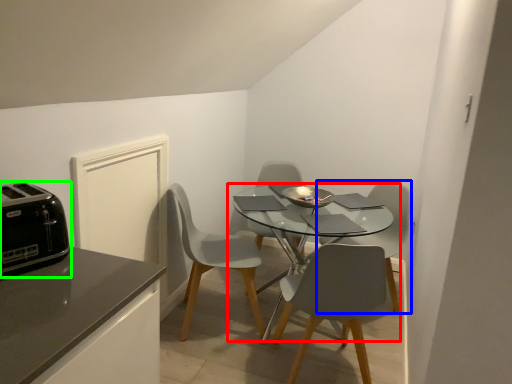
Question: Which object is positioned farthest from kitchen & dining room table (highlighted by a red box)? Select from chair (highlighted by a blue box) and toaster (highlighted by a green box).

Choices:
 (A) chair
 (B) toaster

Answer: (B)